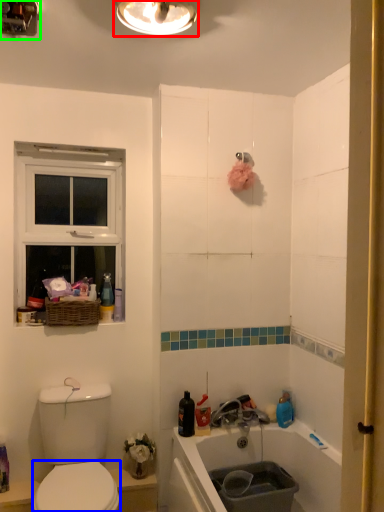
Question: Which object is positioned farthest from light fixture (highlighted by a red box)? Select from bidet (highlighted by a blue box) and light fixture (highlighted by a green box).

Choices:
 (A) bidet
 (B) light fixture

Answer: (A)